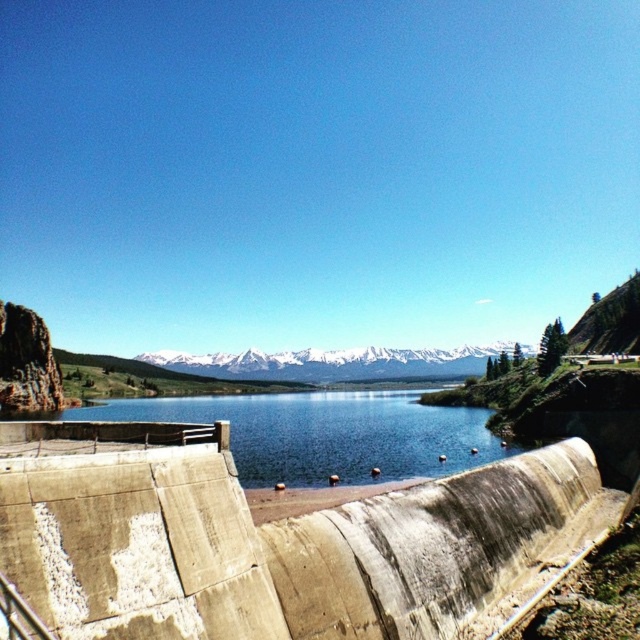
From the picture: Who is more distant from viewer, [268,413] or [248,362]?

The point [248,362] is more distant.

Which is more to the left, blue concrete water at center or white snow-covered mountain at center?

From the viewer's perspective, white snow-covered mountain at center appears more on the left side.

You are a GUI agent. You are given a task and a screenshot of the screen. Output one action in this format:
    pyautogui.click(x=<x>, y=<y>)
    Task: Click on the blue concrete water at center
    The image size is (640, 640).
    Given the screenshot: What is the action you would take?
    pyautogui.click(x=326, y=433)

Who is positioned more to the left, concrete dam at lower center or white snow-covered mountain at center?

Positioned to the left is white snow-covered mountain at center.

Identify the location of concrete dam at lower center. The width and height of the screenshot is (640, 640). (280, 538).

Does concrete dam at lower center have a greater width compared to blue concrete water at center?

No, concrete dam at lower center is not wider than blue concrete water at center.

This screenshot has height=640, width=640. What do you see at coordinates (280, 538) in the screenshot?
I see `concrete dam at lower center` at bounding box center [280, 538].

Does point (595, 541) come farther from viewer compared to point (323, 483)?

No, (595, 541) is in front of (323, 483).

At what (x,y) coordinates should I click in order to perform the action: click on concrete dam at lower center. Please return your answer as a coordinate pair (x, y). Image resolution: width=640 pixels, height=640 pixels. Looking at the image, I should click on (280, 538).